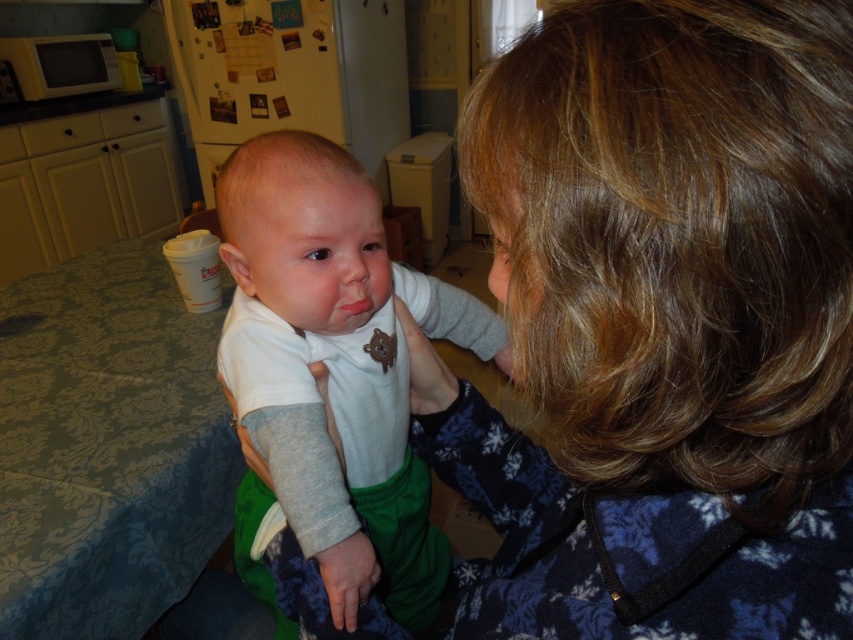
You are a photographer setting up a shoot in this kitchen. You want to ensure that both the blue fleece jacket at upper right and the white soft fabric baby at center are in focus. Since the camera can only focus on one object at a time, which object should you prioritize focusing on to ensure the other is also in focus?

You should focus on the blue fleece jacket at upper right because it is closer to the viewer than the white soft fabric baby at center. When focusing on the closer object, the depth of field may extend to include the farther object in acceptable focus.

Please look at the kitchen scene. There is a point marked at coordinates (660, 323). What object is located at that point?

The point at coordinates (660, 323) indicates the blue fleece jacket at upper right.

You are a photographer setting up a shoot in this kitchen. You need to ensure that the blue fleece jacket at upper right and the white soft fabric baby at center are both visible in the frame. Which object should you adjust to make sure both are fully visible?

Since the blue fleece jacket at upper right is not as tall as the white soft fabric baby at center, you should adjust the angle or position of the camera to ensure both are fully visible, focusing on the taller object, the white soft fabric baby at center, to accommodate the height difference.